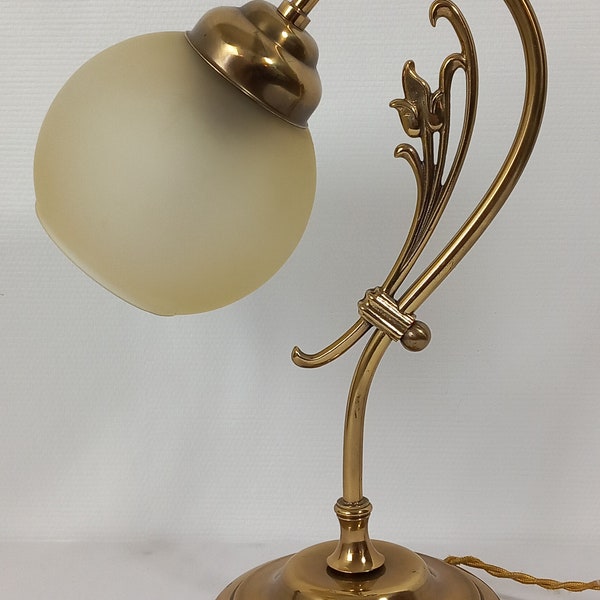
Detect presence of where lamp shade is attached to lamp in the image and mark them. Your answer should be formatted as a list of tuples, i.e. [(x1, y1), (x2, y2), ...], where each tuple contains the x and y coordinates of a point satisfying the conditions above.

[(266, 48)]